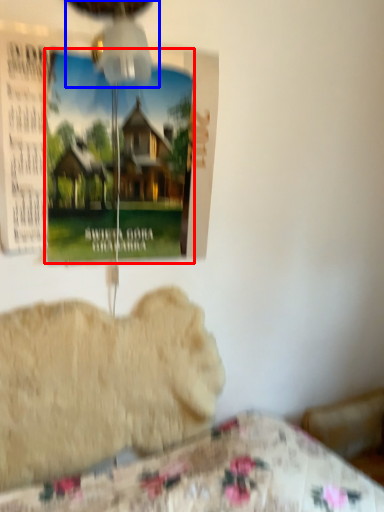
Question: Which of the following is the farthest to the observer, poster page (highlighted by a red box) or mechanical fan (highlighted by a blue box)?

Choices:
 (A) poster page
 (B) mechanical fan

Answer: (A)